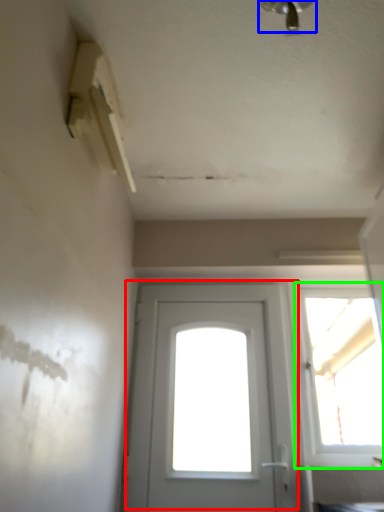
Question: Which is nearer to the door (highlighted by a red box)? light fixture (highlighted by a blue box) or window (highlighted by a green box).

Choices:
 (A) light fixture
 (B) window

Answer: (B)